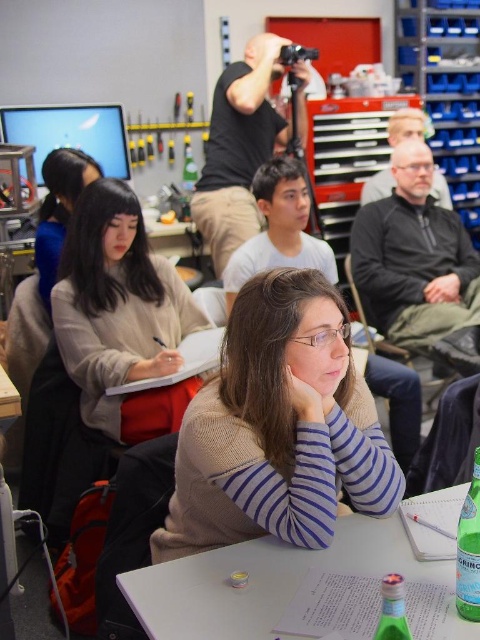
Can you confirm if white plastic table at center is positioned below green glass bottle at lower right?

Indeed, white plastic table at center is positioned under green glass bottle at lower right.

Can you confirm if white plastic table at center is positioned to the right of green glass bottle at lower right?

Incorrect, white plastic table at center is not on the right side of green glass bottle at lower right.

At what (x,y) coordinates should I click in order to perform the action: click on white plastic table at center. Please return your answer as a coordinate pair (x, y). Looking at the image, I should click on (297, 588).

Where is `white plastic table at center`? This screenshot has width=480, height=640. white plastic table at center is located at coordinates (297, 588).

Can you confirm if knit sweater at center is smaller than light beige sweater at center?

Correct, knit sweater at center occupies less space than light beige sweater at center.

In the scene shown: Who is more distant from viewer, (192, 529) or (112, 336)?

The point (112, 336) is more distant.

Locate an element on the screen. The image size is (480, 640). knit sweater at center is located at coordinates (277, 428).

Between light beige sweater at center and green glass bottle at lower right, which one is positioned higher?

light beige sweater at center is above.

Who is positioned more to the left, light beige sweater at center or green glass bottle at lower right?

Positioned to the left is light beige sweater at center.

Between point (59, 352) and point (395, 636), which one is positioned behind?

Point (59, 352)

Image resolution: width=480 pixels, height=640 pixels. I want to click on light beige sweater at center, so click(x=120, y=316).